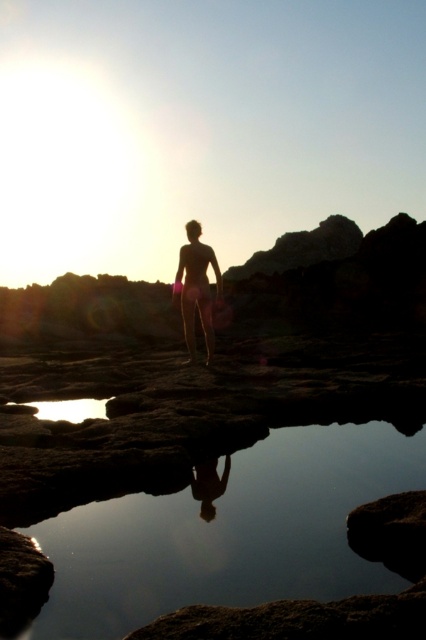
Question: Which point is closer to the camera taking this photo?

Choices:
 (A) (92, 417)
 (B) (164, 560)

Answer: (B)

Question: Is transparent water at center in front of silhouette skin at center?

Choices:
 (A) yes
 (B) no

Answer: (A)

Question: Can you confirm if silhouette skin at center is thinner than transparent glass puddle at lower center?

Choices:
 (A) yes
 (B) no

Answer: (A)

Question: Which object is positioned closest to the transparent water at center?

Choices:
 (A) transparent glass puddle at lower center
 (B) silhouette skin at center

Answer: (A)

Question: Which of the following is the farthest from the observer?

Choices:
 (A) transparent glass puddle at lower center
 (B) transparent water at center
 (C) silhouette skin at center

Answer: (C)

Question: Can you confirm if silhouette skin at center is positioned above transparent glass puddle at lower center?

Choices:
 (A) yes
 (B) no

Answer: (A)